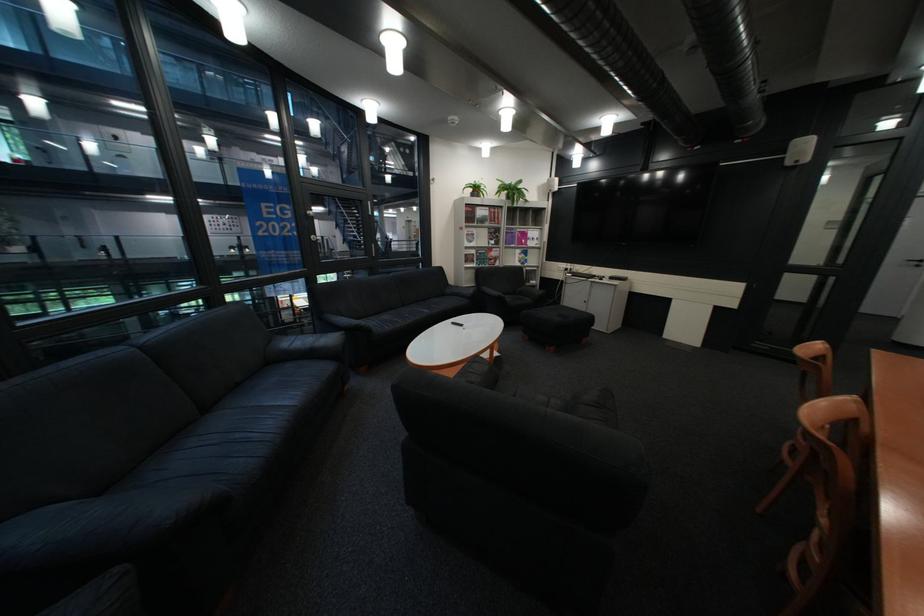
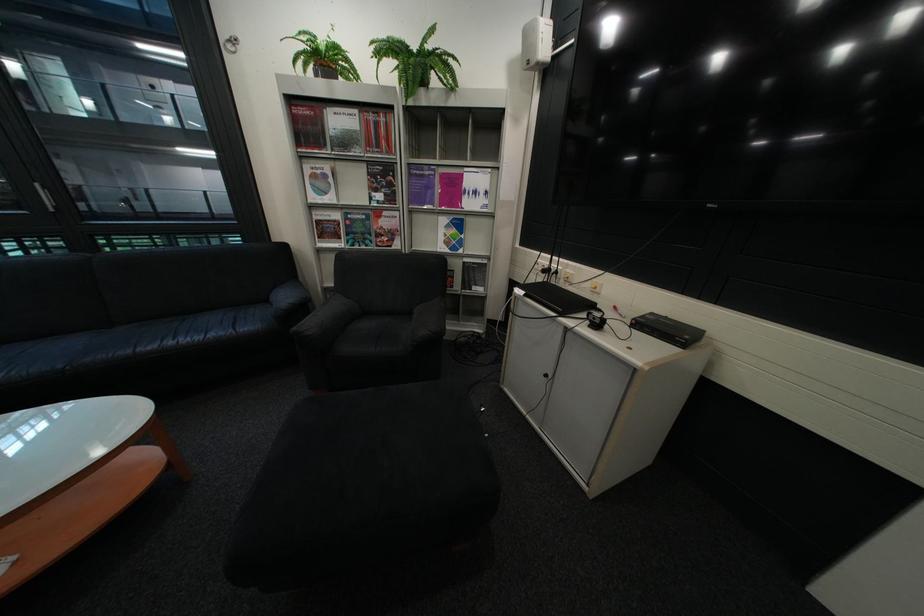
The point at (514, 240) is marked in the first image. Where is the corresponding point in the second image?

(409, 192)